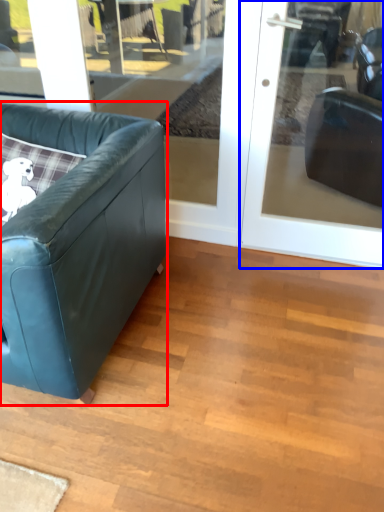
Question: Which of the following is the farthest to the observer, studio couch (highlighted by a red box) or door (highlighted by a blue box)?

Choices:
 (A) studio couch
 (B) door

Answer: (B)